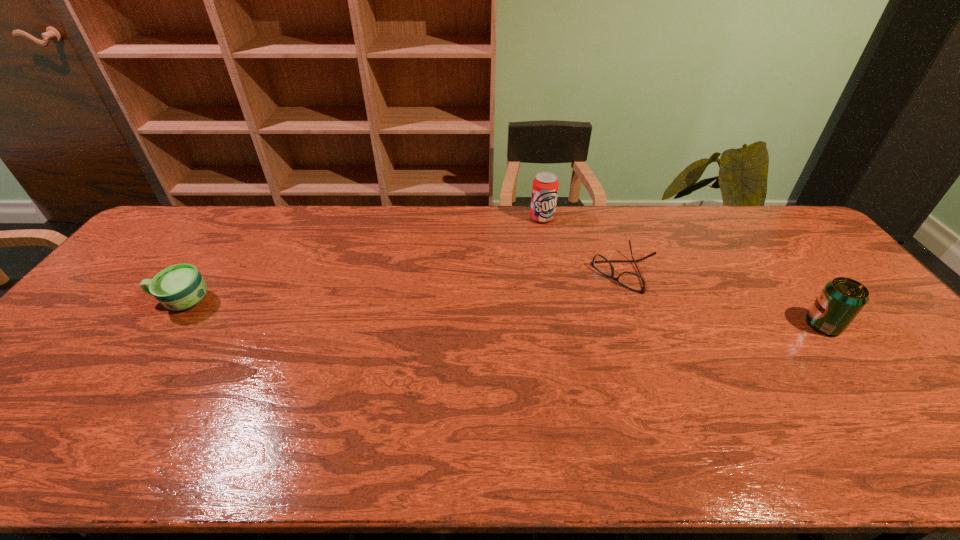
Where is `the second shortest object`? The image size is (960, 540). the second shortest object is located at coordinates (179, 287).

Identify the location of the leftmost object. This screenshot has width=960, height=540. click(179, 287).

The width and height of the screenshot is (960, 540). Find the location of `the rightmost object`. the rightmost object is located at coordinates (841, 300).

The width and height of the screenshot is (960, 540). In order to click on the second tallest object in this screenshot , I will do `click(841, 300)`.

At what (x,y) coordinates should I click in order to perform the action: click on soda can. Please return your answer as a coordinate pair (x, y). Looking at the image, I should click on (545, 186).

Locate an element on the screen. The image size is (960, 540). the farthest object is located at coordinates (545, 186).

In order to click on spectacles in this screenshot , I will do `click(628, 279)`.

The height and width of the screenshot is (540, 960). In order to click on the third object from left to right in this screenshot , I will do `click(628, 279)`.

The height and width of the screenshot is (540, 960). What are the coordinates of `free region located on the front of the leftmost object` in the screenshot? It's located at (132, 373).

I want to click on free space located on the back of the second tallest object, so (x=795, y=288).